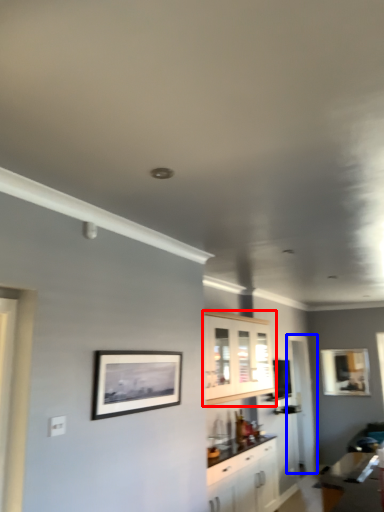
Question: Among these objects, which one is nearest to the camera, cabinetry (highlighted by a red box) or glass door (highlighted by a blue box)?

Choices:
 (A) cabinetry
 (B) glass door

Answer: (A)